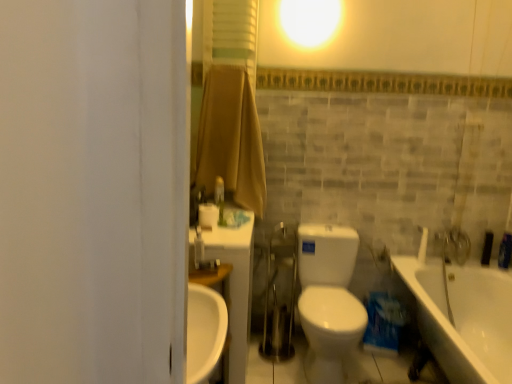
Question: Is white glossy faucet at upper right aimed at white plastic faucet at upper left?

Choices:
 (A) no
 (B) yes

Answer: (A)

Question: Can white plastic faucet at upper left be found inside white glossy faucet at upper right?

Choices:
 (A) no
 (B) yes

Answer: (A)

Question: Is the depth of white glossy faucet at upper right greater than that of white plastic faucet at upper left?

Choices:
 (A) no
 (B) yes

Answer: (B)

Question: Are white glossy faucet at upper right and white plastic faucet at upper left making contact?

Choices:
 (A) no
 (B) yes

Answer: (A)

Question: Is white glossy faucet at upper right not close to white plastic faucet at upper left?

Choices:
 (A) no
 (B) yes

Answer: (B)

Question: Considering the positions of point (425, 238) and point (309, 238), is point (425, 238) closer or farther from the camera than point (309, 238)?

Choices:
 (A) closer
 (B) farther

Answer: (B)

Question: Looking at the image, does white glossy faucet at upper right seem bigger or smaller compared to white glossy toilet at center?

Choices:
 (A) big
 (B) small

Answer: (B)

Question: Which is correct: white glossy faucet at upper right is inside white glossy toilet at center, or outside of it?

Choices:
 (A) inside
 (B) outside

Answer: (B)

Question: In terms of height, does white glossy faucet at upper right look taller or shorter compared to white glossy toilet at center?

Choices:
 (A) short
 (B) tall

Answer: (A)

Question: Based on their sizes in the image, would you say white matte toilet paper at center is bigger or smaller than white glossy toilet at center?

Choices:
 (A) small
 (B) big

Answer: (A)

Question: Considering the positions of point (201, 203) and point (303, 302), is point (201, 203) closer or farther from the camera than point (303, 302)?

Choices:
 (A) closer
 (B) farther

Answer: (A)

Question: Would you say white matte toilet paper at center is to the left or to the right of white glossy toilet at center in the picture?

Choices:
 (A) right
 (B) left

Answer: (B)

Question: Looking at their shapes, would you say white matte toilet paper at center is wider or thinner than white glossy toilet at center?

Choices:
 (A) thin
 (B) wide

Answer: (A)

Question: Would you say white matte toilet paper at center is inside or outside white glossy faucet at upper right?

Choices:
 (A) inside
 (B) outside

Answer: (B)

Question: Visually, is white matte toilet paper at center positioned to the left or to the right of white glossy faucet at upper right?

Choices:
 (A) right
 (B) left

Answer: (B)